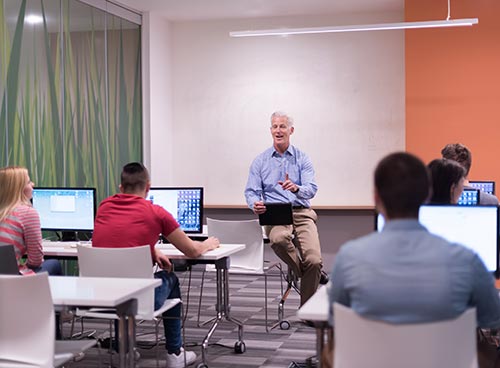
Where is `computers`? computers is located at coordinates (75, 207), (178, 203), (434, 230), (472, 194), (479, 183).